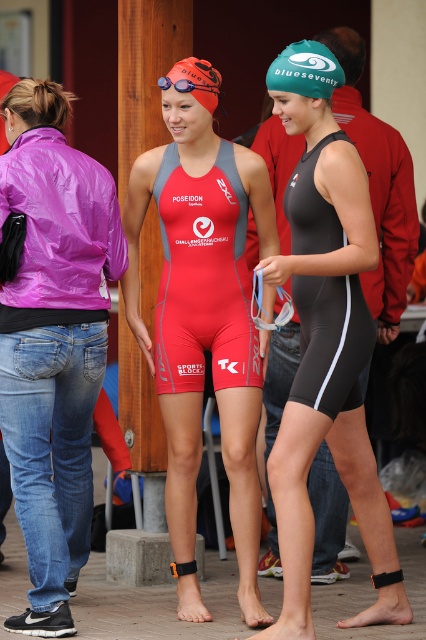
Question: Can you confirm if matte red wetsuit at center is thinner than orange matte swim cap at upper center?

Choices:
 (A) no
 (B) yes

Answer: (A)

Question: Which point is farther from the camera taking this photo?

Choices:
 (A) (344, 83)
 (B) (207, 109)

Answer: (A)

Question: Which of the following is the closest to the observer?

Choices:
 (A) (227, 192)
 (B) (215, 248)
 (C) (60, 368)
 (D) (298, 605)

Answer: (D)

Question: Does matte red wetsuit at center appear over teal matte swim cap at upper center?

Choices:
 (A) no
 (B) yes

Answer: (A)

Question: Which point is farther to the camera?

Choices:
 (A) (322, 81)
 (B) (322, 202)

Answer: (B)

Question: Does matte red swimsuit at center appear on the left side of matte black swimsuit at center?

Choices:
 (A) no
 (B) yes

Answer: (B)